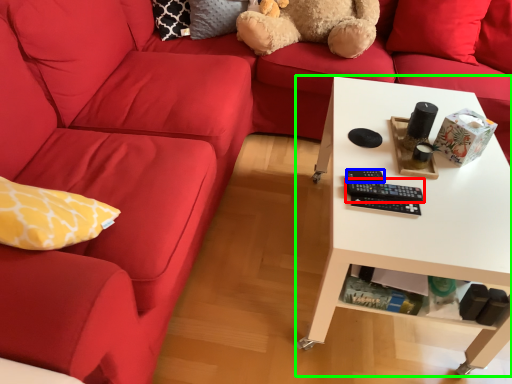
Question: Based on their relative distances, which object is farther from control (highlighted by a red box)? Choose from control (highlighted by a blue box) and table (highlighted by a green box).

Choices:
 (A) control
 (B) table

Answer: (B)